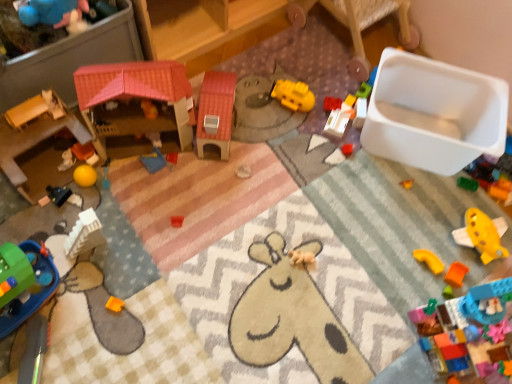
This screenshot has width=512, height=384. Find the location of `vacant area that lies between yellow matte plastic arch at lower right, which appears as the twelfth toy when viewed from the left, and matte orange blocks at left, the eleventh toy viewed from the right`. vacant area that lies between yellow matte plastic arch at lower right, which appears as the twelfth toy when viewed from the left, and matte orange blocks at left, the eleventh toy viewed from the right is located at coordinates (262, 215).